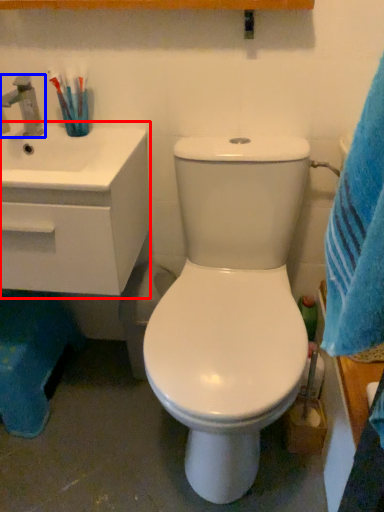
Question: Which object is closer to the camera taking this photo, counter top (highlighted by a red box) or tap (highlighted by a blue box)?

Choices:
 (A) counter top
 (B) tap

Answer: (A)